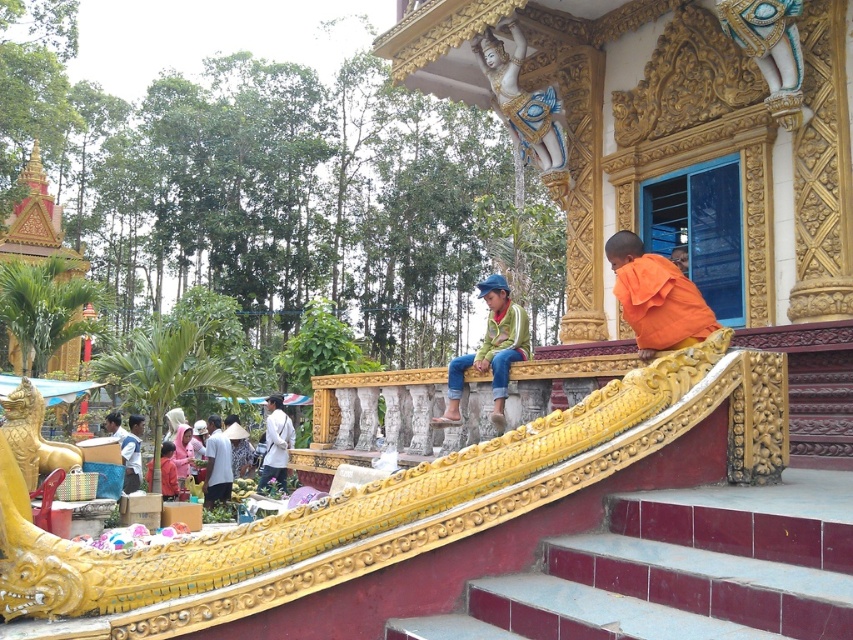
What is the spatial relationship between the orange cloth at upper right and any other objects in the scene?

The orange cloth at upper right is located at point (656, 298) in the scene.

You are standing at the entrance of the temple and want to reach the monk seated on the curved golden railing. The maroon tile stairs at lower center is represented by point (x=679, y=572). Which direction should you move relative to the stairs to reach the monk?

The maroon tile stairs at lower center is represented by point (x=679, y=572). To reach the monk seated on the curved golden railing, you should move upward from the stairs as the monk is positioned higher in the scene than the stairs.

You are a tourist standing at the entrance of the temple and want to reach the monk sitting on the curved golden railing. You see the maroon tile stairs at lower center and the green matte jacket at center. Which object is closer to you as you stand at the entrance?

The maroon tile stairs at lower center is in front of the green matte jacket at center, so the maroon tile stairs at lower center is closer to you as you stand at the entrance.